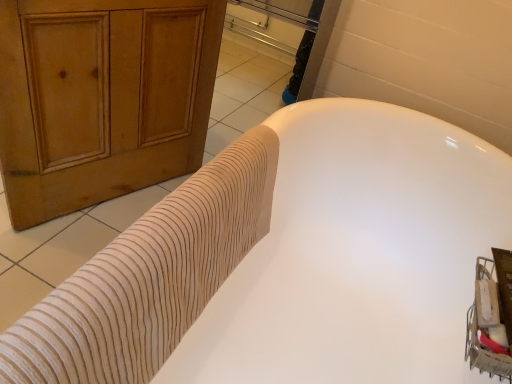
Question: Would you say white ribbed tub at center is inside or outside beige textured towel at upper left?

Choices:
 (A) outside
 (B) inside

Answer: (A)

Question: From the image's perspective, is white ribbed tub at center positioned above or below beige textured towel at upper left?

Choices:
 (A) above
 (B) below

Answer: (B)

Question: Considering the positions of white ribbed tub at center and beige textured towel at upper left in the image, is white ribbed tub at center wider or thinner than beige textured towel at upper left?

Choices:
 (A) thin
 (B) wide

Answer: (B)

Question: Would you say beige textured towel at upper left is to the left or to the right of white ribbed tub at center in the picture?

Choices:
 (A) left
 (B) right

Answer: (A)

Question: Is beige textured towel at upper left in front of or behind white ribbed tub at center in the image?

Choices:
 (A) front
 (B) behind

Answer: (B)

Question: Considering the positions of point (229, 258) and point (376, 203), is point (229, 258) closer or farther from the camera than point (376, 203)?

Choices:
 (A) closer
 (B) farther

Answer: (A)

Question: In terms of height, does beige textured towel at upper left look taller or shorter compared to white ribbed tub at center?

Choices:
 (A) tall
 (B) short

Answer: (B)